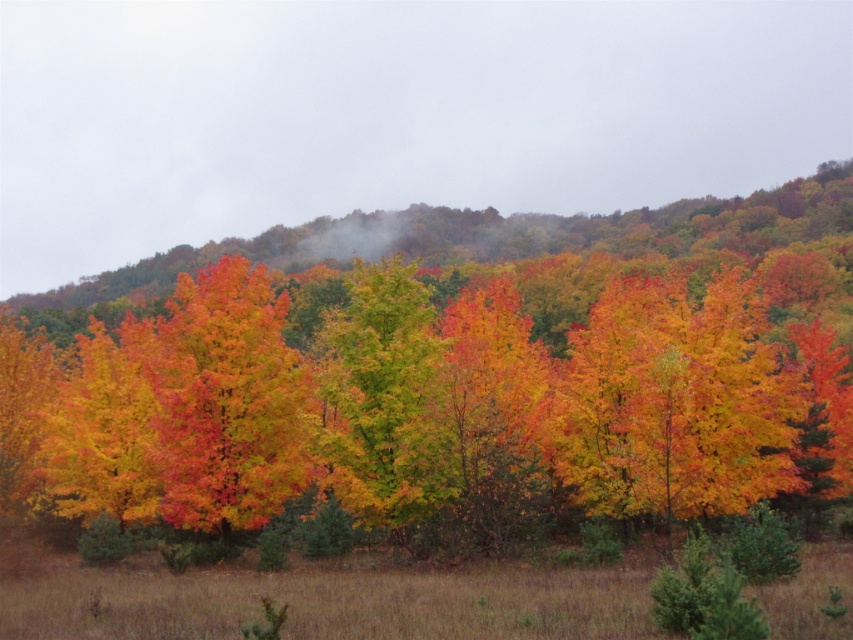
You are standing in the autumn landscape and notice the vivid orange leaves at center and the green matte tree at center. Which object is positioned higher in the scene?

The vivid orange leaves at center are positioned higher than the green matte tree at center in the scene.